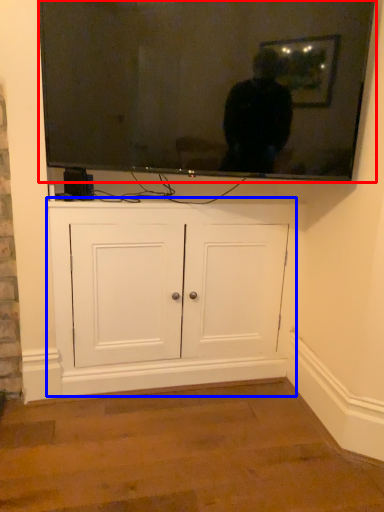
Question: Which point is closer to the camera, television (highlighted by a red box) or cabinetry (highlighted by a blue box)?

Choices:
 (A) television
 (B) cabinetry

Answer: (A)